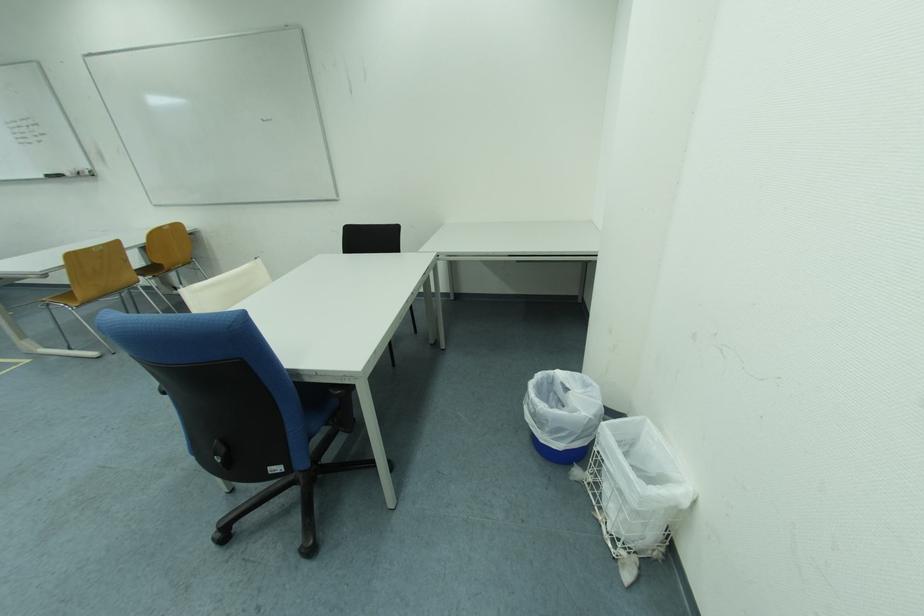
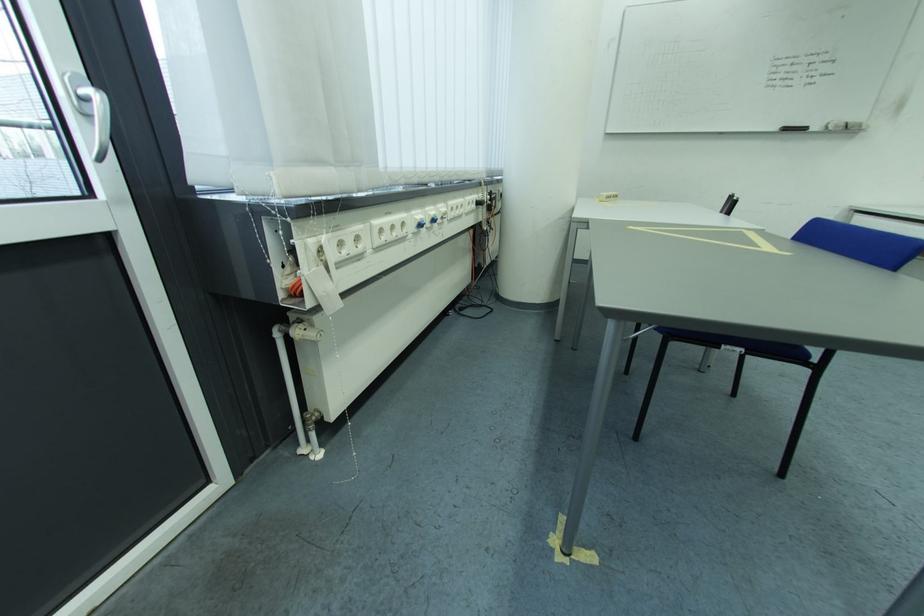
Where in the second image is the point corresponding to (57,179) from the first image?

(796, 131)